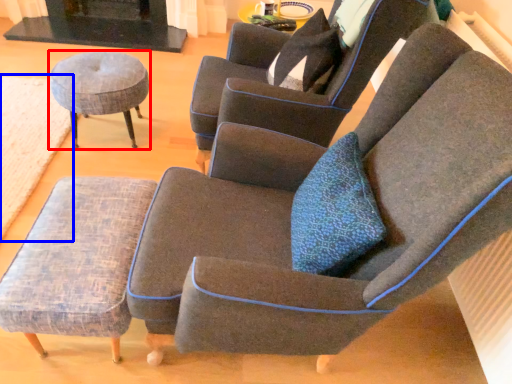
Question: Which object is further to the camera taking this photo, stool (highlighted by a red box) or mat (highlighted by a blue box)?

Choices:
 (A) stool
 (B) mat

Answer: (A)